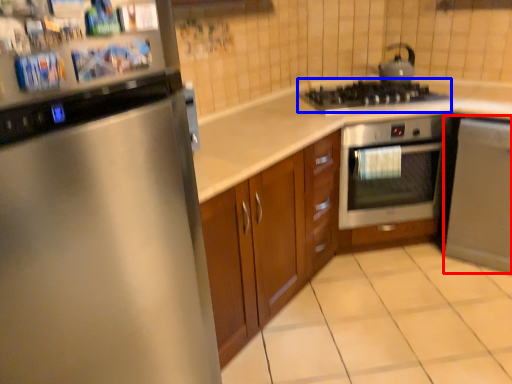
Question: Among these objects, which one is farthest to the camera, dish washer (highlighted by a red box) or gas stove (highlighted by a blue box)?

Choices:
 (A) dish washer
 (B) gas stove

Answer: (B)